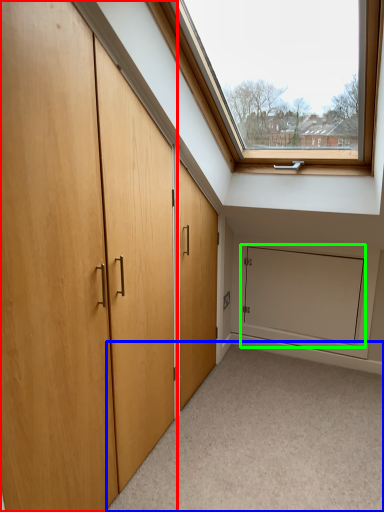
Question: Which is farther away from door (highlighted by a red box)? corridor (highlighted by a blue box) or screen door (highlighted by a green box)?

Choices:
 (A) corridor
 (B) screen door

Answer: (B)